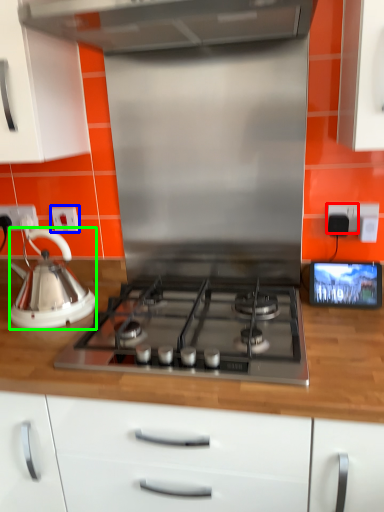
Question: Which object is the closest to the electric outlet (highlighted by a red box)? Choose among these: electric outlet (highlighted by a blue box) or kettle (highlighted by a green box).

Choices:
 (A) electric outlet
 (B) kettle

Answer: (A)